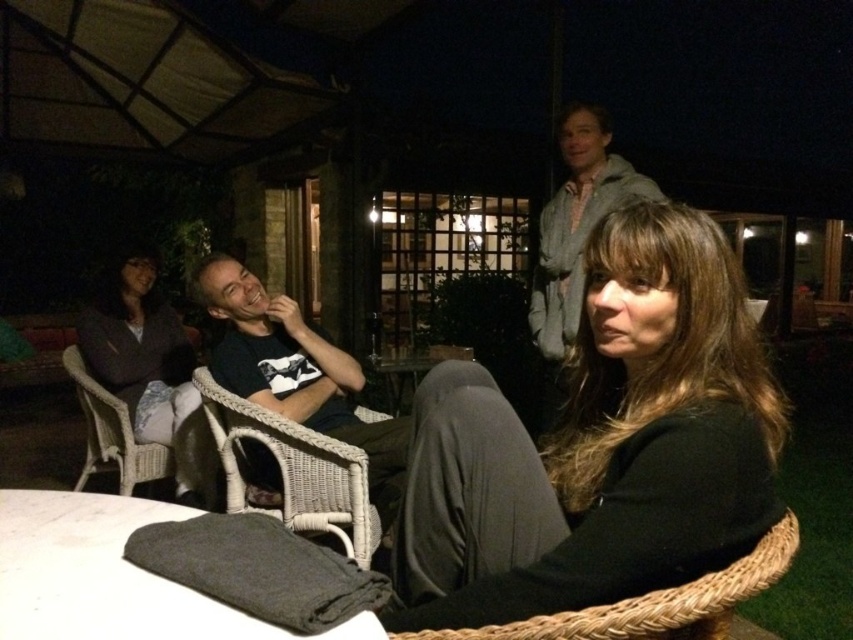
You are a photographer setting up a tripod in the scene. You need to place it between the gray fabric at lower center and the wicker chair at left. Is there enough space for the tripod?

The gray fabric at lower center is located above the wicker chair at left, so there is vertical space between them. However, the horizontal distance between the two objects isn not specified, so it is unclear if there is enough space for the tripod.

You are organizing a charity event and need to decide which jacket to display first. If the black matte jacket at center is narrower than the dark gray fabric jacket at left, which one should you choose to fit into a narrow display stand that can only accommodate jackets up to the width of the narrower one?

The black matte jacket at center should be chosen because its width is less than the dark gray fabric jacket at left, making it suitable for the narrow display stand.